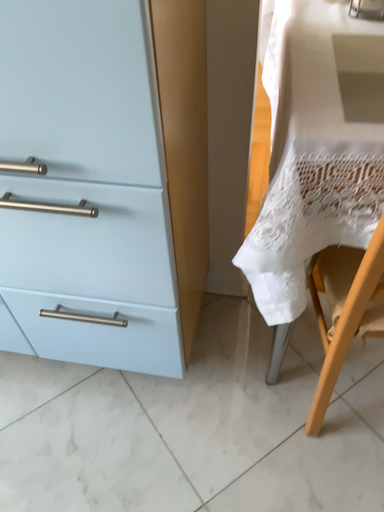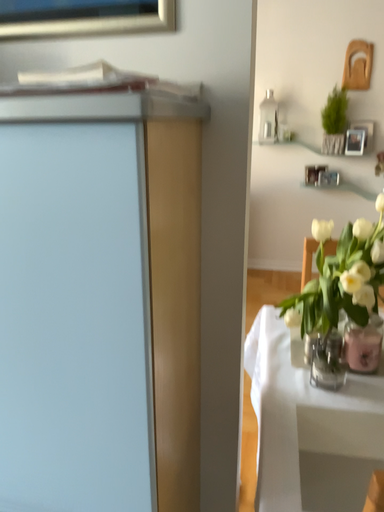
Question: Which way did the camera rotate in the video?

Choices:
 (A) rotated upward
 (B) rotated downward

Answer: (A)